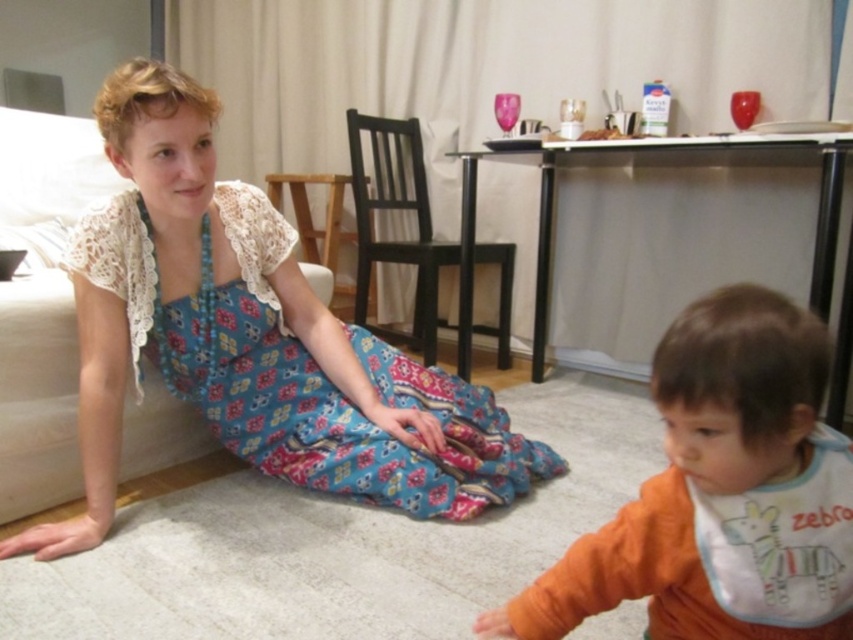
Can you confirm if blue printed fabric dress at lower left is shorter than white fabric bib at lower right?

No.

Is blue printed fabric dress at lower left further to the viewer compared to white fabric bib at lower right?

Yes, blue printed fabric dress at lower left is behind white fabric bib at lower right.

Measure the distance between blue printed fabric dress at lower left and camera.

blue printed fabric dress at lower left is 1.45 meters away from camera.

This screenshot has width=853, height=640. I want to click on blue printed fabric dress at lower left, so pos(299,372).

Identify the location of orange fleece sweater at lower right. (711, 490).

Which is below, orange fleece sweater at lower right or white fabric bib at lower right?

white fabric bib at lower right

This screenshot has height=640, width=853. What do you see at coordinates (711, 490) in the screenshot? I see `orange fleece sweater at lower right` at bounding box center [711, 490].

Find the location of a particular element. orange fleece sweater at lower right is located at coordinates (711, 490).

Which is above, orange fleece sweater at lower right or blue printed fabric dress at lower left?

blue printed fabric dress at lower left

The width and height of the screenshot is (853, 640). Describe the element at coordinates (711, 490) in the screenshot. I see `orange fleece sweater at lower right` at that location.

This screenshot has width=853, height=640. I want to click on orange fleece sweater at lower right, so click(711, 490).